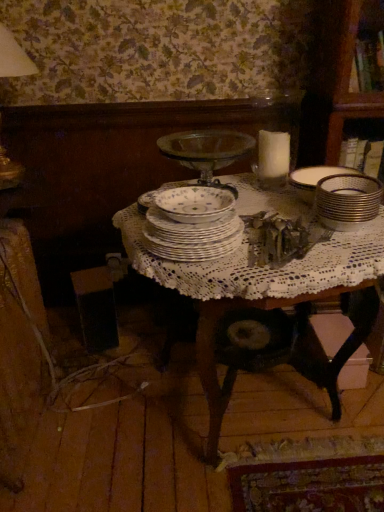
Where is `vacant space situated above white lace tablecloth at center (from a real-world perspective)`? This screenshot has width=384, height=512. vacant space situated above white lace tablecloth at center (from a real-world perspective) is located at coordinates [275, 212].